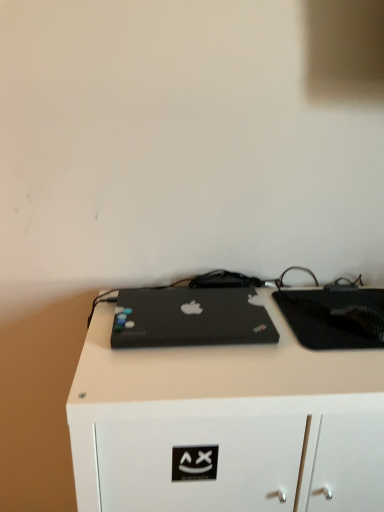
Locate an element on the screen. free space to the right of black matte laptop at center is located at coordinates (306, 341).